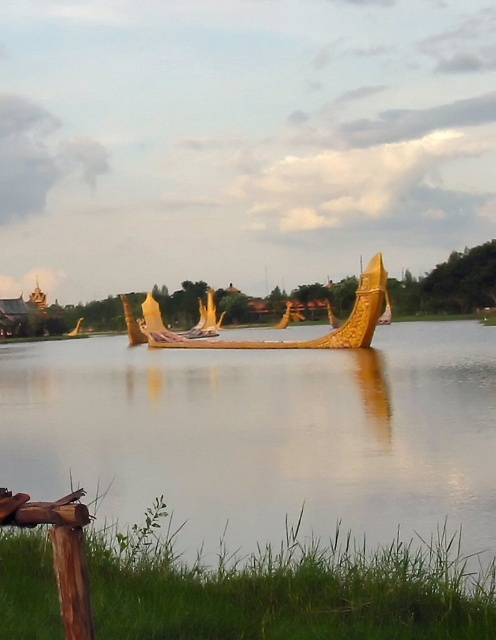
Question: Is smooth gold water at center to the right of gold polished wood boat at center from the viewer's perspective?

Choices:
 (A) yes
 (B) no

Answer: (B)

Question: Which object appears farthest from the camera in this image?

Choices:
 (A) gold polished wood boat at center
 (B) smooth gold water at center

Answer: (A)

Question: Can you confirm if smooth gold water at center is positioned to the left of gold polished wood boat at center?

Choices:
 (A) yes
 (B) no

Answer: (A)

Question: Is smooth gold water at center positioned before gold polished wood boat at center?

Choices:
 (A) yes
 (B) no

Answer: (A)

Question: Which of the following is the farthest from the observer?

Choices:
 (A) smooth gold water at center
 (B) gold polished wood boat at center

Answer: (B)